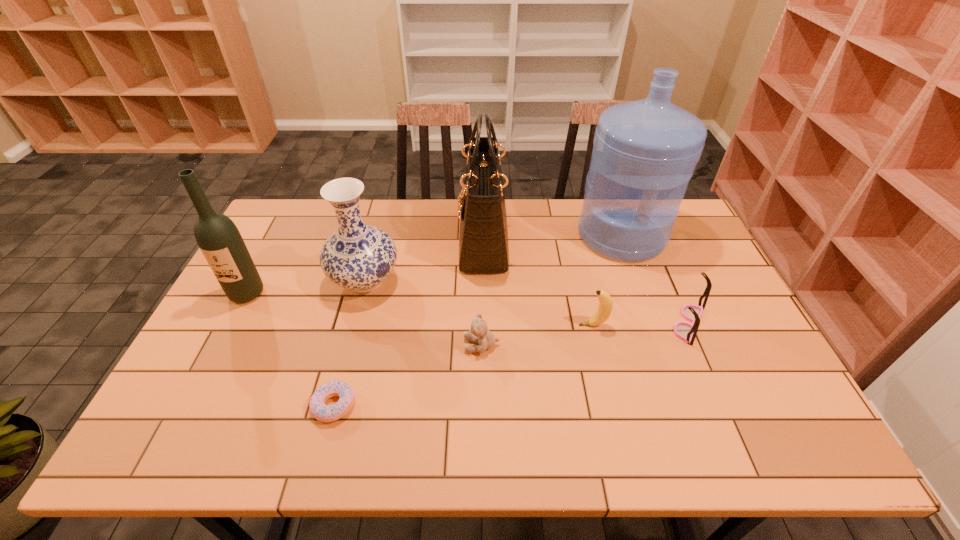
The image size is (960, 540). Identify the location of vacant space located on the face of the second shortest object. (338, 345).

The width and height of the screenshot is (960, 540). I want to click on free region located 0.180m on the face of the second shortest object, so click(395, 345).

Locate an element on the screen. free region located on the left of the doughnut is located at coordinates (291, 406).

Find the location of `water jug at the far edge`. water jug at the far edge is located at coordinates (645, 152).

Where is `handbag that is positioned at the far edge`? The width and height of the screenshot is (960, 540). handbag that is positioned at the far edge is located at coordinates (483, 237).

Find the location of `object at the near edge`. object at the near edge is located at coordinates (324, 413).

The height and width of the screenshot is (540, 960). Identify the location of object that is at the left edge. (220, 241).

Image resolution: width=960 pixels, height=540 pixels. Find the location of `water jug positioned at the right edge`. water jug positioned at the right edge is located at coordinates (645, 152).

Image resolution: width=960 pixels, height=540 pixels. In order to click on spectacles at the right edge in this screenshot , I will do `click(685, 331)`.

Where is `object at the far right corner`? The image size is (960, 540). object at the far right corner is located at coordinates (645, 152).